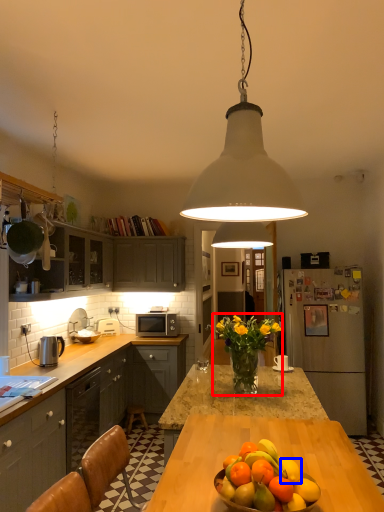
Question: Among these objects, which one is nearest to the camera, floral arrangement (highlighted by a red box) or citrus fruit (highlighted by a blue box)?

Choices:
 (A) floral arrangement
 (B) citrus fruit

Answer: (B)